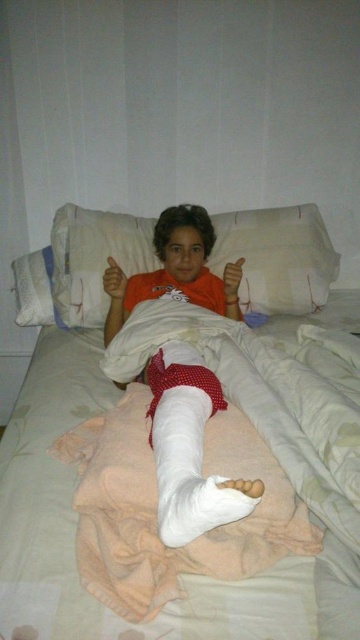
Question: Does white soft bed at center appear on the right side of matte orange hand at center?

Choices:
 (A) yes
 (B) no

Answer: (A)

Question: Is white soft pillow at center thinner than orange matte hand at center?

Choices:
 (A) yes
 (B) no

Answer: (B)

Question: Does white bandage at center have a smaller size compared to white soft pillow at center?

Choices:
 (A) yes
 (B) no

Answer: (B)

Question: Which object is the closest to the orange matte hand at center?

Choices:
 (A) white bandage at center
 (B) matte orange hand at center
 (C) white soft pillow at center
 (D) white soft bed at center

Answer: (A)

Question: Among these objects, which one is nearest to the camera?

Choices:
 (A) matte orange hand at center
 (B) orange matte hand at center

Answer: (A)

Question: Which point is closer to the camera taking this photo?

Choices:
 (A) (240, 339)
 (B) (191, 264)

Answer: (A)